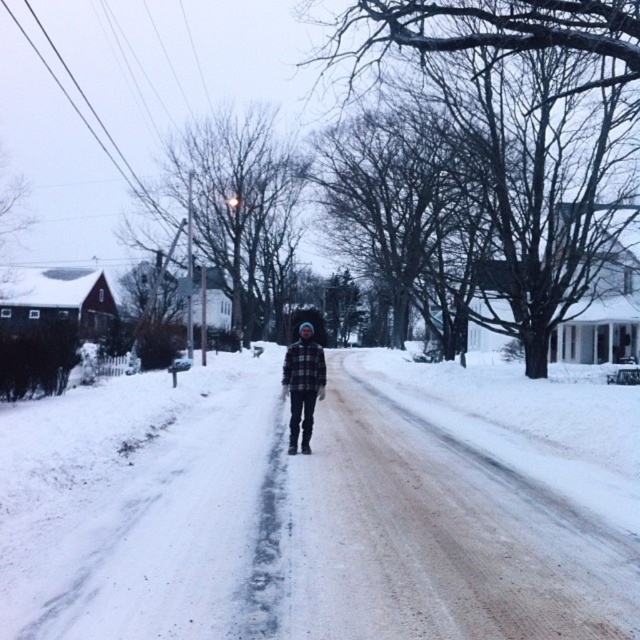
Consider the image. You are a photographer trying to capture the scene with the white fluffy snow at center and the plaid flannel shirt at center. Based on their heights, which object would appear larger in the photo?

The plaid flannel shirt at center would appear larger in the photo because it is taller than the white fluffy snow at center.

You are a photographer trying to capture the person in the winter scene. You notice the white fluffy snow at center and the plaid flannel shirt at center. Which object is wider in the image?

The white fluffy snow at center might be wider than plaid flannel shirt at center according to the description.